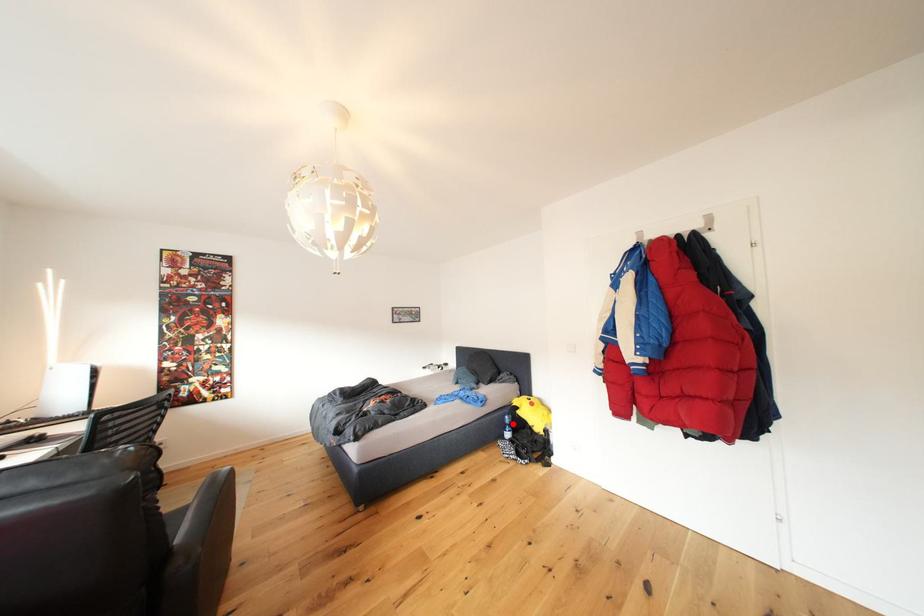
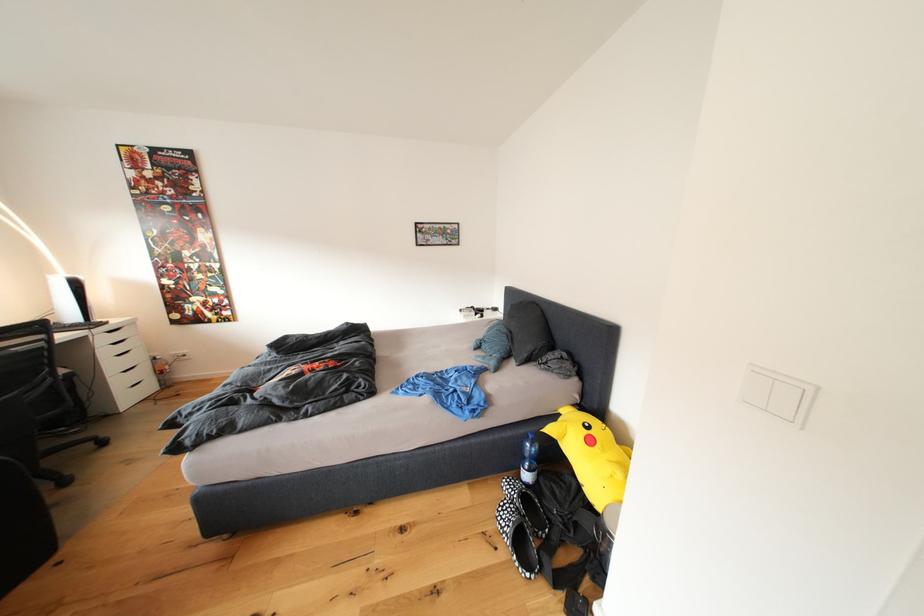
Question: I am providing you with two images of the same scene from different viewpoints. Given a red point in image1, look at the same physical point in image2. Is it:

Choices:
 (A) Closer to the viewpoint
 (B) Farther from the viewpoint

Answer: (A)